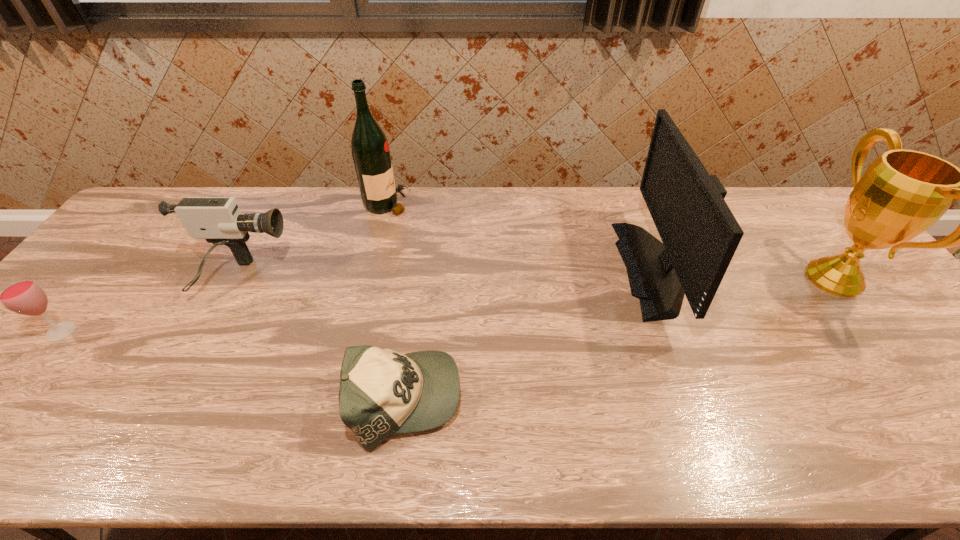
Identify which object is the fourth closest to the wine bottle. Please provide its 2D coordinates. Your answer should be formatted as a tuple, i.e. [(x, y)], where the tuple contains the x and y coordinates of a point satisfying the conditions above.

[(23, 295)]

Identify the location of object that is the fourth closest to the wine bottle. (x=23, y=295).

The height and width of the screenshot is (540, 960). What are the coordinates of `free space that satisfies the following two spatial constraints: 1. on the back side of the wine bottle; 2. on the right side of the wineglass` in the screenshot? It's located at (166, 204).

Image resolution: width=960 pixels, height=540 pixels. Find the location of `free space that satisfies the following two spatial constraints: 1. on the screen side of the monitor; 2. on the front side of the fifth tallest object`. free space that satisfies the following two spatial constraints: 1. on the screen side of the monitor; 2. on the front side of the fifth tallest object is located at coordinates (687, 332).